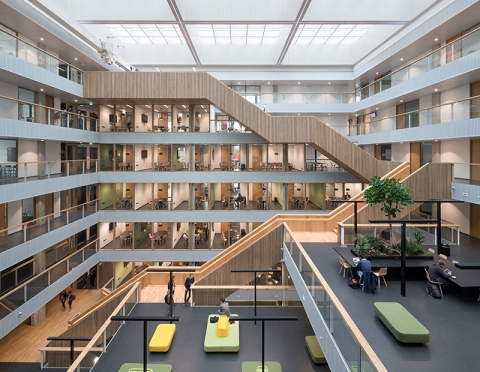
Where is `load bearing columns`? load bearing columns is located at coordinates (193, 158), (190, 125), (187, 198), (192, 240), (192, 264), (283, 202), (287, 160), (284, 276), (286, 305).